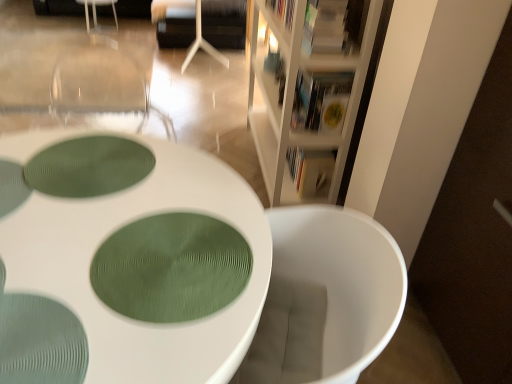
You are a GUI agent. You are given a task and a screenshot of the screen. Output one action in this format:
    pyautogui.click(x=<x>, y=<y>)
    Task: Click on the vacant space to the right of green textured placemat at center, the second oval when ordered from front to back
    Image resolution: width=512 pixels, height=384 pixels.
    Given the screenshot: What is the action you would take?
    pyautogui.click(x=190, y=195)